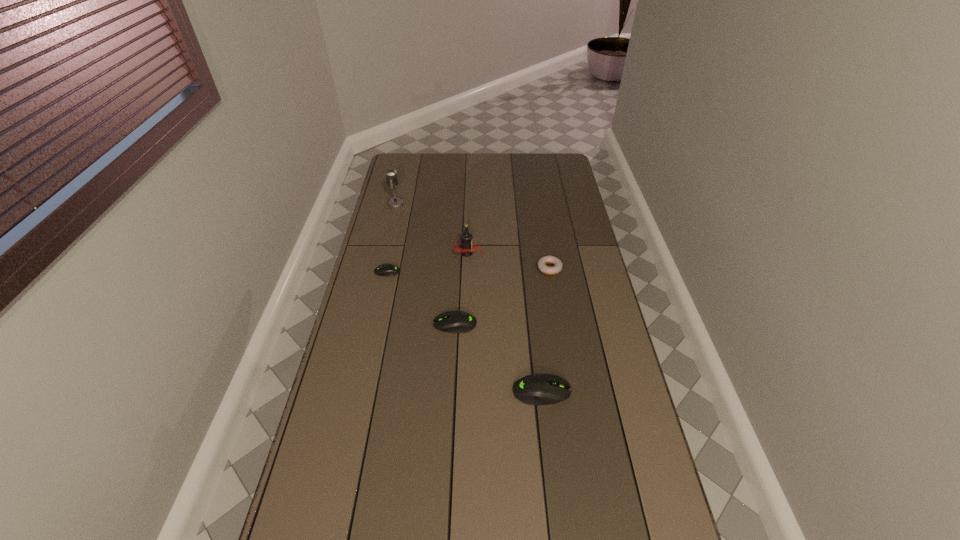
I want to click on free space between the root beer and the nearest object, so click(505, 322).

The height and width of the screenshot is (540, 960). I want to click on empty space that is in between the fifth shortest object and the doughnut, so click(x=509, y=261).

I want to click on vacant point located between the fifth shortest object and the farthest computer mouse, so click(427, 263).

The image size is (960, 540). I want to click on blank region between the microphone and the second computer mouse from right to left, so click(425, 264).

The image size is (960, 540). In order to click on free point between the tallest object and the second computer mouse from right to left in this screenshot , I will do `click(425, 264)`.

The height and width of the screenshot is (540, 960). What are the coordinates of `empty space that is in between the rightmost computer mouse and the doughnut` in the screenshot? It's located at (545, 330).

Select which object is the third closest to the fifth farthest object. Please provide its 2D coordinates. Your answer should be formatted as a tuple, i.e. [(x, y)], where the tuple contains the x and y coordinates of a point satisfying the conditions above.

[(466, 243)]

Locate which object ranks in proximity to the root beer. Please provide its 2D coordinates. Your answer should be formatted as a tuple, i.e. [(x, y)], where the tuple contains the x and y coordinates of a point satisfying the conditions above.

[(388, 270)]

At what (x,y) coordinates should I click in order to perform the action: click on computer mouse that is the second closest to the second nearest object. Please return your answer as a coordinate pair (x, y). Image resolution: width=960 pixels, height=540 pixels. Looking at the image, I should click on pyautogui.click(x=388, y=270).

Identify which computer mouse is the closest to the fifth shortest object. Please provide its 2D coordinates. Your answer should be formatted as a tuple, i.e. [(x, y)], where the tuple contains the x and y coordinates of a point satisfying the conditions above.

[(388, 270)]